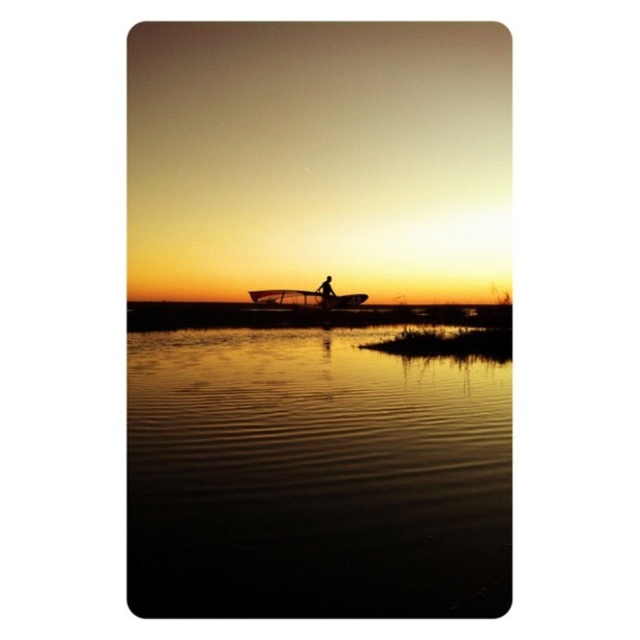
Question: Among these objects, which one is nearest to the camera?

Choices:
 (A) metallic silver boat at center
 (B) glossy reflective water at center
 (C) silhouette figure at center

Answer: (B)

Question: Does glossy reflective water at center lie behind metallic silver boat at center?

Choices:
 (A) yes
 (B) no

Answer: (B)

Question: Which object appears farthest from the camera in this image?

Choices:
 (A) metallic silver boat at center
 (B) silhouette figure at center
 (C) glossy reflective water at center

Answer: (B)

Question: Is glossy reflective water at center to the left of silhouette figure at center from the viewer's perspective?

Choices:
 (A) yes
 (B) no

Answer: (A)

Question: Which object is the farthest from the silhouette figure at center?

Choices:
 (A) glossy reflective water at center
 (B) metallic silver boat at center

Answer: (A)

Question: Can you confirm if metallic silver boat at center is positioned to the right of silhouette figure at center?

Choices:
 (A) no
 (B) yes

Answer: (A)